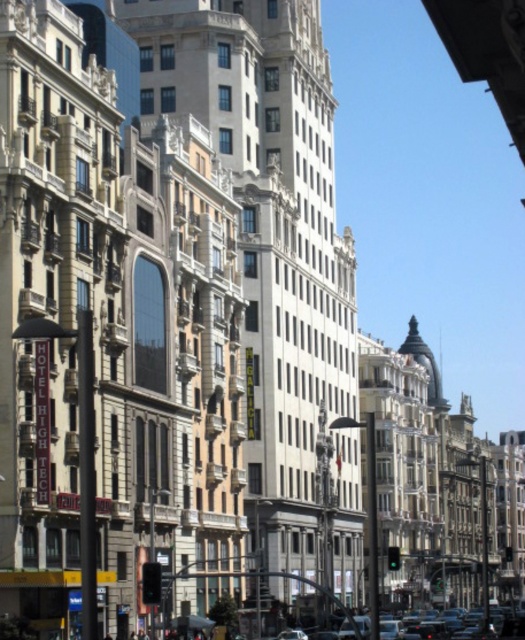
You are a delivery drone flying over an urban area and need to land on a designated landing pad located at coordinates 0.9, 0.3. There is a black plastic traffic light at lower center in the scene. Can you safely land at the designated coordinates without hitting the traffic light?

The black plastic traffic light at lower center is positioned at point (151, 582), which is very close to the landing pad coordinates (157, 576). The drone should avoid landing there to prevent collision with the traffic light.

You are standing at the point marked by point (275, 259) in the image. Looking around, you see a smooth gray building at center. Which direction should you face to see the smooth gray building at center?

You should face forward because the smooth gray building at center is directly in front of you at the point marked by point (275, 259).

You are a pedestrian looking at the street scene. You see the black plastic traffic light at lower center and the green glass traffic light at center. Which one is positioned higher?

The black plastic traffic light at lower center is positioned higher than the green glass traffic light at center.